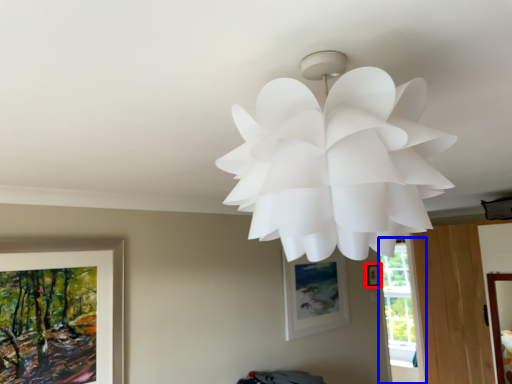
Question: Which object appears farthest to the camera in this image, picture frame (highlighted by a red box) or window (highlighted by a blue box)?

Choices:
 (A) picture frame
 (B) window

Answer: (B)